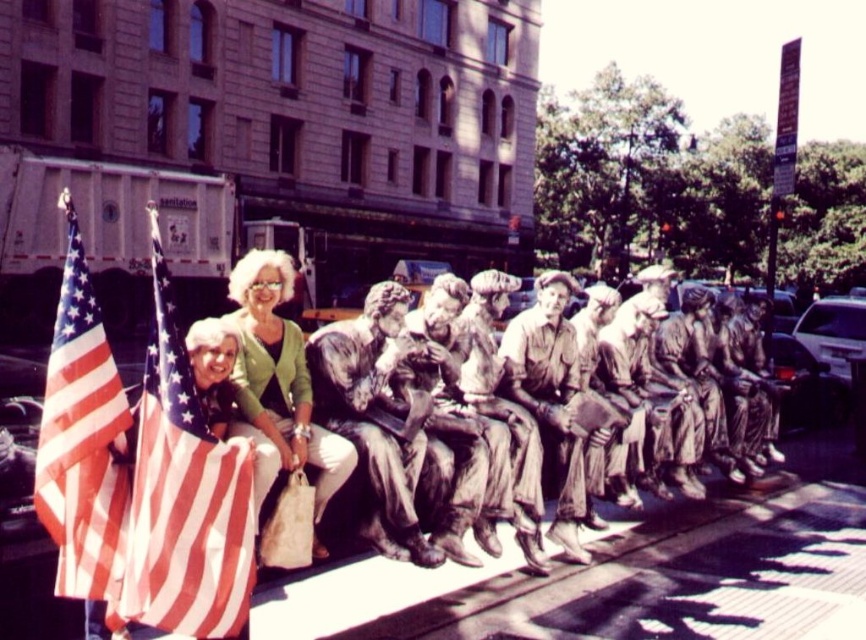
Where is the american flag at left located in the image?

The american flag at left is located at point (185, 496).

You are a photographer trying to capture a photo of the matte green sweater at center and the american flag at left. Based on their positions, which object should you adjust your camera to focus on first if you want to include both in the frame?

The american flag at left is to the left of matte green sweater at center, so you should focus on the american flag at left first to ensure both are in the frame.